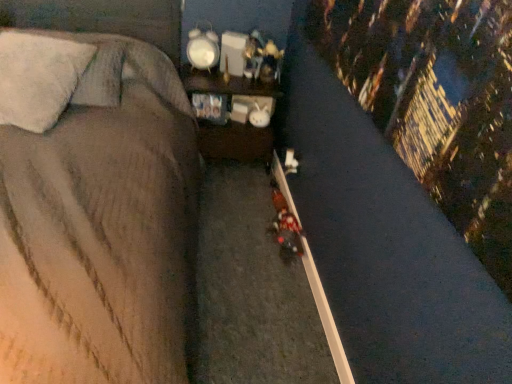
Question: Based on their sizes in the image, would you say shiny plastic toy at center is bigger or smaller than soft gray fabric bed at center?

Choices:
 (A) small
 (B) big

Answer: (A)

Question: Looking at their shapes, would you say shiny plastic toy at center is wider or thinner than soft gray fabric bed at center?

Choices:
 (A) wide
 (B) thin

Answer: (B)

Question: Considering the real-world distances, which object is farthest from the soft gray fabric bed at center?

Choices:
 (A) wooden shelf at center
 (B) white fluffy pillow at upper left
 (C) shiny plastic toy at center

Answer: (C)

Question: Estimate the real-world distances between objects in this image. Which object is farther from the wooden shelf at center?

Choices:
 (A) shiny plastic toy at center
 (B) soft gray fabric bed at center
 (C) white fluffy pillow at upper left

Answer: (C)